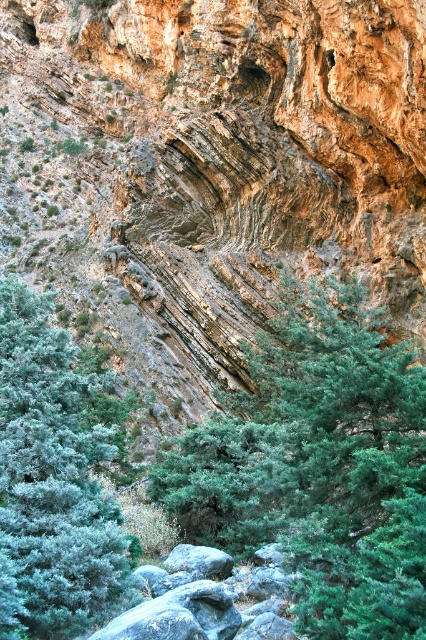
You are a hiker carrying a 10 meter long rope. You want to tie the rope between the green leafy tree at center and the green matte tree at center. Will the rope be long enough?

The distance between the green leafy tree at center and the green matte tree at center is 9.83 meters, so the 10 meter long rope will be long enough to tie between them.

Consider the image. You are a hiker planning to cross the rugged, rocky landscape. You notice two trees in the center of the image. Which tree, the green leafy tree at center or the green matte tree at center, would you choose to use as a marker for your path and why?

The green leafy tree at center is thinner than the green matte tree at center. Since the green leafy tree at center is thinner, it might be more flexible and less stable, making the green matte tree at center a better choice as a marker due to its thicker structure for long term visibility.

You are a hiker standing at the base of the cliff and see both the green leafy tree at center and the green matte tree at center. Which tree is closer to you?

The green leafy tree at center is closer to you because it is positioned below the green matte tree at center, indicating it is in a lower, more foreground position.